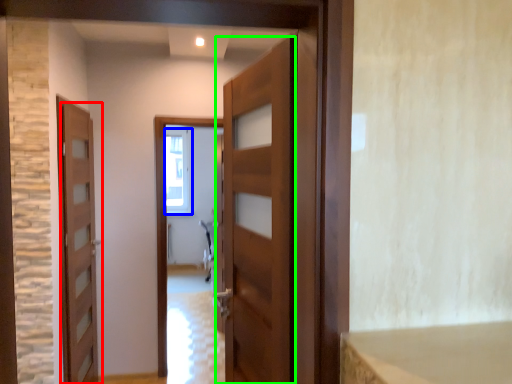
Question: Estimate the real-world distances between objects in this image. Which object is farther from door (highlighted by a red box), window (highlighted by a blue box) or door (highlighted by a green box)?

Choices:
 (A) window
 (B) door

Answer: (A)